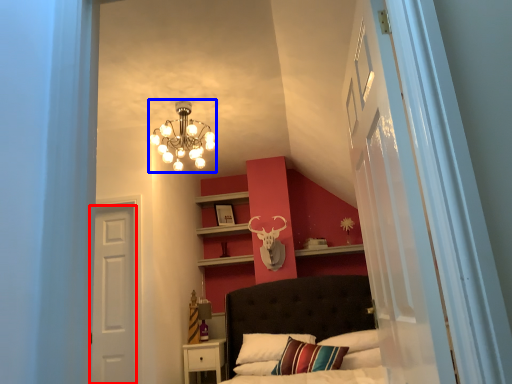
Question: Which point is closer to the camera, door (highlighted by a red box) or lamp (highlighted by a blue box)?

Choices:
 (A) door
 (B) lamp

Answer: (B)